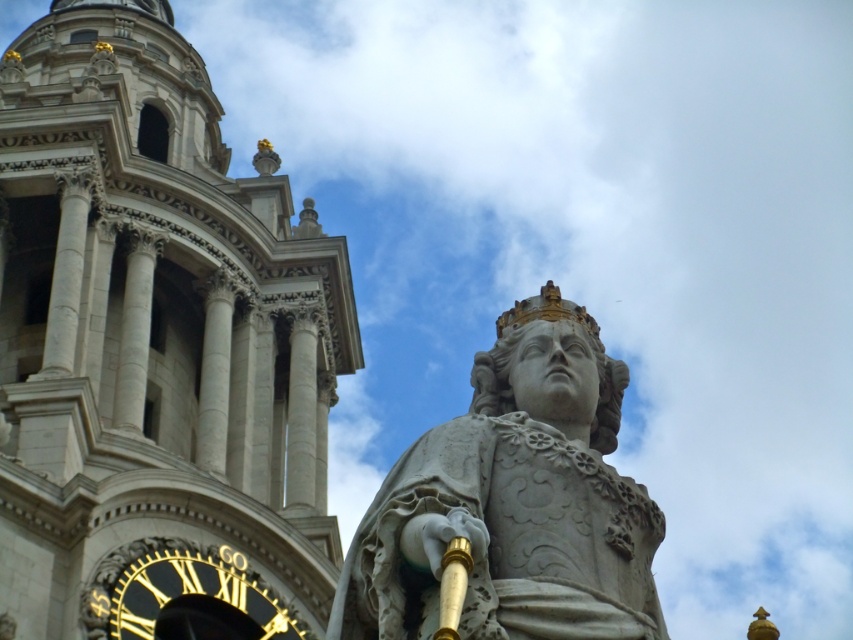
Question: Which point is closer to the camera?

Choices:
 (A) (532, 472)
 (B) (222, 576)

Answer: (A)

Question: Can you confirm if white stone tower at upper center is thinner than white stone statue at center?

Choices:
 (A) no
 (B) yes

Answer: (A)

Question: Is white stone tower at upper center positioned in front of white stone statue at center?

Choices:
 (A) yes
 (B) no

Answer: (B)

Question: Considering the real-world distances, which object is closest to the goldmaterial/textureclock at lower left?

Choices:
 (A) white stone tower at upper center
 (B) white stone statue at center

Answer: (B)

Question: Considering the relative positions of white stone tower at upper center and goldmaterial/textureclock at lower left in the image provided, where is white stone tower at upper center located with respect to goldmaterial/textureclock at lower left?

Choices:
 (A) below
 (B) above

Answer: (B)

Question: Which of the following is the closest to the observer?

Choices:
 (A) white stone statue at center
 (B) white stone tower at upper center

Answer: (A)